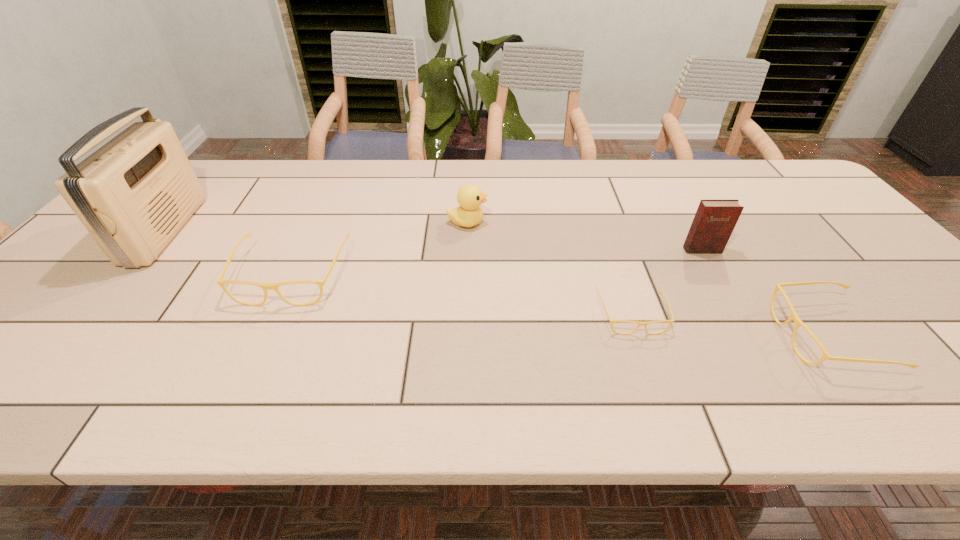
Please determine a free point for an extra spectacles to ensure balance. Please provide its 2D coordinates. Your answer should be formatted as a tuple, i.e. [(x, y)], where the tuple contains the x and y coordinates of a point satisfying the conditions above.

[(454, 294)]